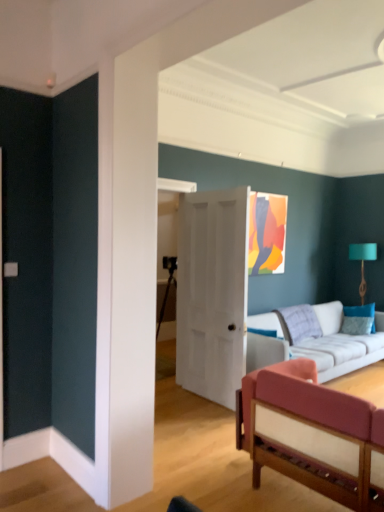
Question: From the image's perspective, would you say teal fabric lampshade at right is shown under white matte door at center?

Choices:
 (A) no
 (B) yes

Answer: (A)

Question: Is teal fabric lampshade at right behind white matte door at center?

Choices:
 (A) no
 (B) yes

Answer: (B)

Question: Is teal fabric lampshade at right shorter than white matte door at center?

Choices:
 (A) yes
 (B) no

Answer: (A)

Question: Is teal fabric lampshade at right positioned with its back to white matte door at center?

Choices:
 (A) no
 (B) yes

Answer: (A)

Question: Is teal fabric lampshade at right thinner than white matte door at center?

Choices:
 (A) yes
 (B) no

Answer: (B)

Question: In the image, is velvet pink couch at lower right, which is the 1th studio couch in front-to-back order, positioned in front of or behind teal fabric pillow at right?

Choices:
 (A) front
 (B) behind

Answer: (A)

Question: Is velvet pink couch at lower right, arranged as the 2th studio couch when viewed from the back, to the left or to the right of teal fabric pillow at right in the image?

Choices:
 (A) left
 (B) right

Answer: (A)

Question: Is point (362, 458) positioned closer to the camera than point (357, 309)?

Choices:
 (A) closer
 (B) farther

Answer: (A)

Question: Considering the positions of velvet pink couch at lower right, which is the 1th studio couch in front-to-back order, and teal fabric pillow at right in the image, is velvet pink couch at lower right, which is the 1th studio couch in front-to-back order, wider or thinner than teal fabric pillow at right?

Choices:
 (A) thin
 (B) wide

Answer: (B)

Question: From a real-world perspective, relative to teal fabric pillow at right, is teal fabric lampshade at right vertically above or below?

Choices:
 (A) above
 (B) below

Answer: (A)

Question: Is point (375, 243) positioned closer to the camera than point (357, 316)?

Choices:
 (A) closer
 (B) farther

Answer: (B)

Question: Considering the positions of teal fabric lampshade at right and teal fabric pillow at right in the image, is teal fabric lampshade at right taller or shorter than teal fabric pillow at right?

Choices:
 (A) short
 (B) tall

Answer: (B)

Question: Is teal fabric lampshade at right wider or thinner than teal fabric pillow at right?

Choices:
 (A) wide
 (B) thin

Answer: (A)

Question: Is point (304, 415) closer or farther from the camera than point (372, 345)?

Choices:
 (A) closer
 (B) farther

Answer: (A)

Question: Based on their positions, is velvet pink couch at lower right, which is the 1th studio couch in front-to-back order, located to the left or right of white fabric couch at center, which ranks as the 2th studio couch in front-to-back order?

Choices:
 (A) left
 (B) right

Answer: (A)